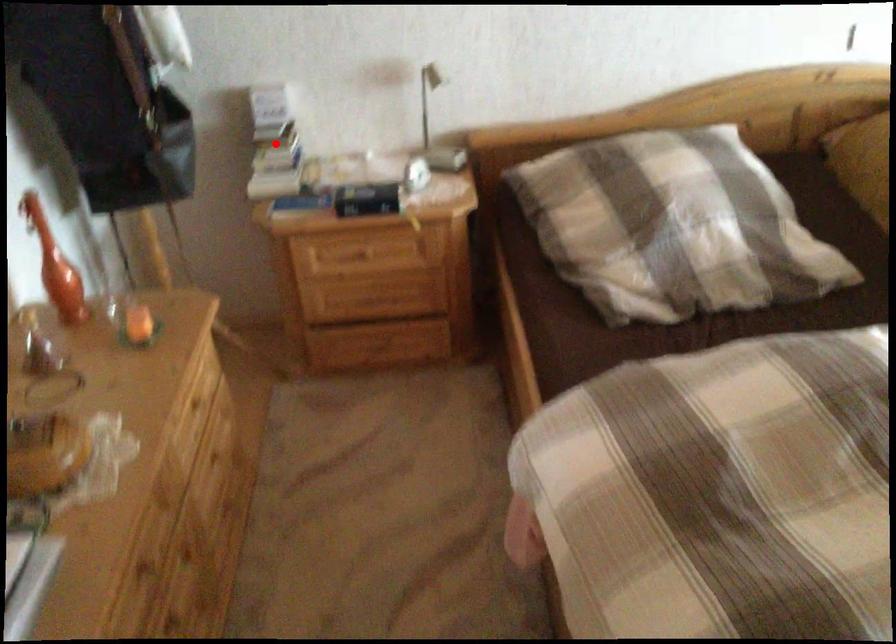
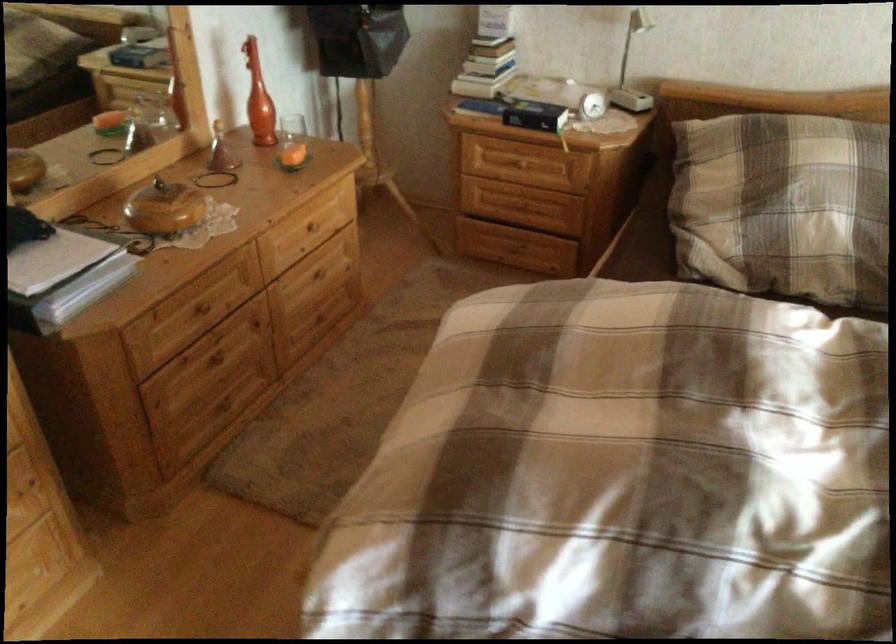
Locate, in the second image, the point that corresponds to the highlighted location in the first image.

(487, 49)